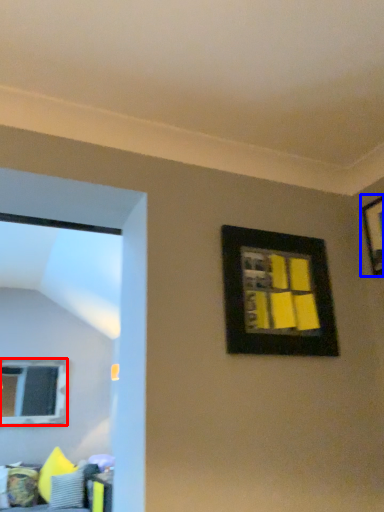
Question: Which point is closer to the camera, window (highlighted by a red box) or picture frame (highlighted by a blue box)?

Choices:
 (A) window
 (B) picture frame

Answer: (B)